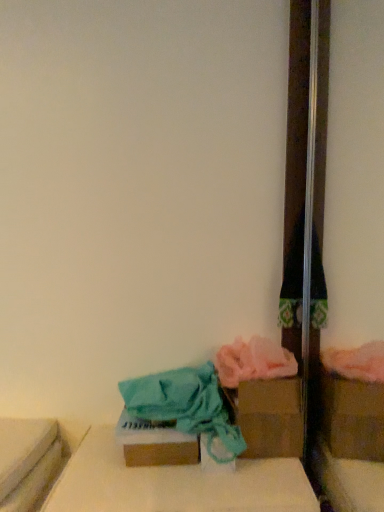
At what (x,y) coordinates should I click in order to perform the action: click on empty space that is ontop of brown cardboard box at lower right, the second storage box positioned from the left (from a real-world perspective). Please return your answer as a coordinate pair (x, y). Looking at the image, I should click on (256, 369).